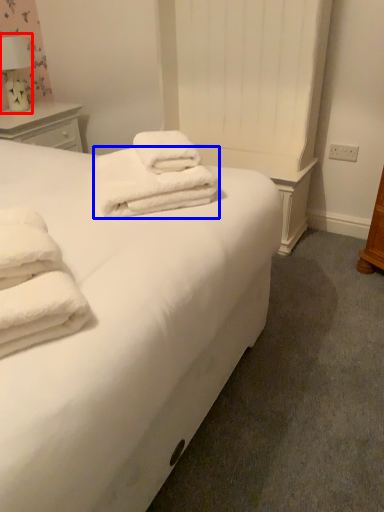
Question: Which point is closer to the camera, table lamp (highlighted by a red box) or towel (highlighted by a blue box)?

Choices:
 (A) table lamp
 (B) towel

Answer: (B)